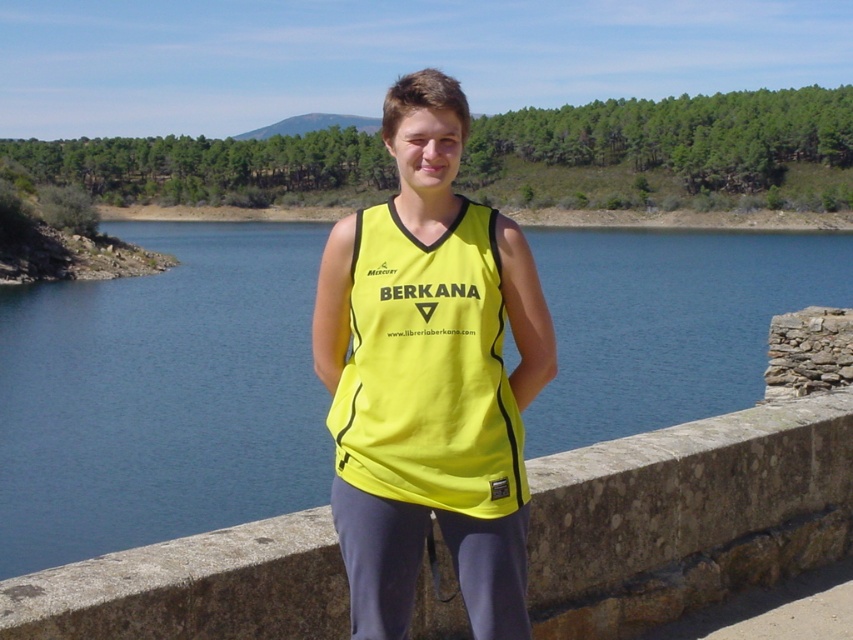
You are a hiker who needs to cross a narrow path between the smooth stone ledge at center and the yellow fabric safety vest at center. The path is only as wide as the narrower object. Can you safely walk through it if your shoulders are 1.5 meters wide?

The smooth stone ledge at center has a lesser width compared to yellow fabric safety vest at center. Since the path is as wide as the narrower object, which is the smooth stone ledge at center, and your shoulders are 1.5 meters wide, you cannot safely walk through the path because it is narrower than your shoulder width.